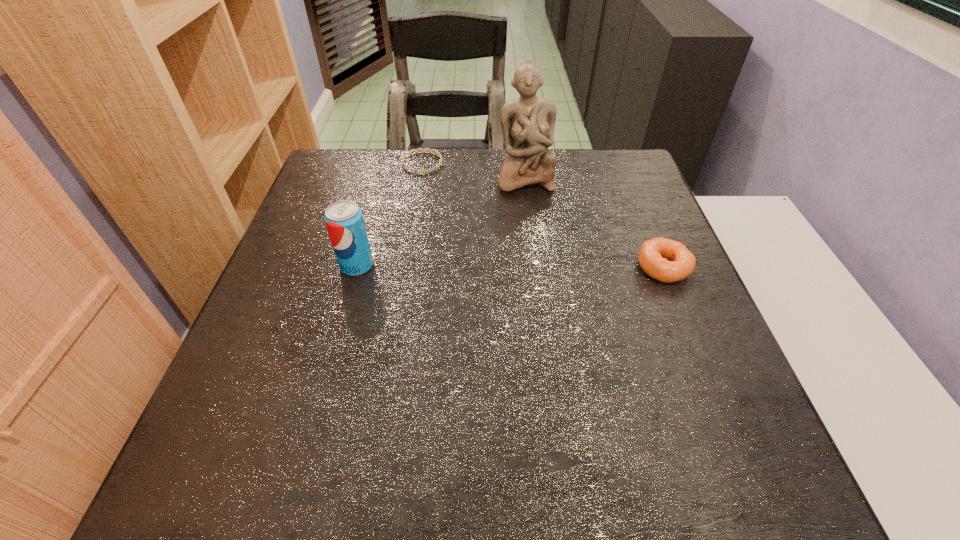
Find the location of a particular element. This screenshot has width=960, height=540. vacant region between the second object from right to left and the soda can is located at coordinates (441, 222).

What are the coordinates of `blank region between the figurine and the rightmost object` in the screenshot? It's located at (594, 222).

Locate an element on the screen. The height and width of the screenshot is (540, 960). blank region between the rightmost object and the figurine is located at coordinates [594, 222].

Image resolution: width=960 pixels, height=540 pixels. I want to click on free space between the bracelet and the soda can, so click(x=390, y=214).

This screenshot has height=540, width=960. Find the location of `free spot between the soda can and the figurine`. free spot between the soda can and the figurine is located at coordinates (441, 222).

Locate an element on the screen. The width and height of the screenshot is (960, 540). vacant point located between the shortest object and the third object from left to right is located at coordinates click(x=473, y=171).

Identify which object is the nearest to the third tallest object. Please provide its 2D coordinates. Your answer should be formatted as a tuple, i.e. [(x, y)], where the tuple contains the x and y coordinates of a point satisfying the conditions above.

[(528, 122)]

Where is `object that can be found as the closest to the tallest object`? This screenshot has height=540, width=960. object that can be found as the closest to the tallest object is located at coordinates (430, 151).

Identify the location of vacant space that satisfies the following two spatial constraints: 1. on the front side of the bracelet; 2. on the right side of the figurine. Image resolution: width=960 pixels, height=540 pixels. (420, 178).